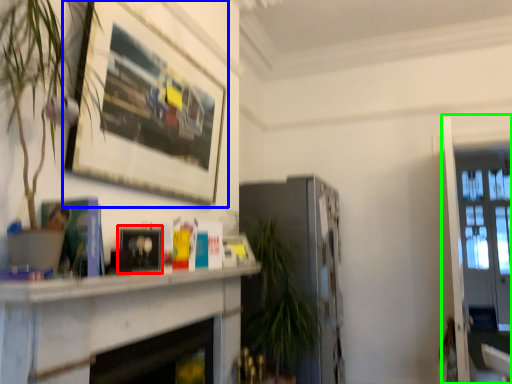
Question: Based on their relative distances, which object is farther from picture frame (highlighted by a red box)? Choose from picture frame (highlighted by a blue box) and glass door (highlighted by a green box).

Choices:
 (A) picture frame
 (B) glass door

Answer: (B)